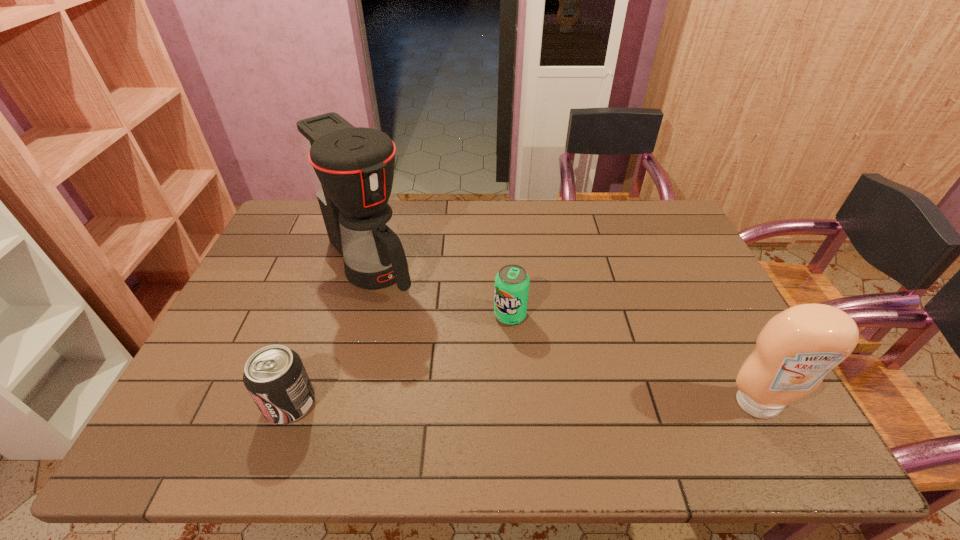
Locate an element on the screen. This screenshot has height=540, width=960. vacant area at the right edge is located at coordinates (715, 362).

You are a GUI agent. You are given a task and a screenshot of the screen. Output one action in this format:
    pyautogui.click(x=<x>, y=<y>)
    Task: Click on the vacant space at the far right corner of the desktop
    The image size is (960, 540).
    Given the screenshot: What is the action you would take?
    tap(676, 237)

This screenshot has width=960, height=540. I want to click on free space between the second object from right to left and the condiment, so click(635, 360).

At what (x,y) coordinates should I click in order to perform the action: click on empty location between the nearer pop soda and the third object from left to right. Please return your answer as a coordinate pair (x, y). This screenshot has height=540, width=960. Looking at the image, I should click on (400, 359).

Find the location of a particular element. This screenshot has width=960, height=540. vacant area that lies between the right pop soda and the condiment is located at coordinates (635, 360).

Find the location of a particular element. The image size is (960, 540). vacant space that's between the farther pop soda and the left pop soda is located at coordinates (400, 359).

Where is `vacant space in between the third object from left to right and the left pop soda`? vacant space in between the third object from left to right and the left pop soda is located at coordinates (400, 359).

Where is `free area in between the left pop soda and the rightmost object`? This screenshot has height=540, width=960. free area in between the left pop soda and the rightmost object is located at coordinates (524, 403).

This screenshot has width=960, height=540. Identify the location of vacant space that's between the right pop soda and the condiment. (635, 360).

The height and width of the screenshot is (540, 960). I want to click on free space between the condiment and the left pop soda, so click(524, 403).